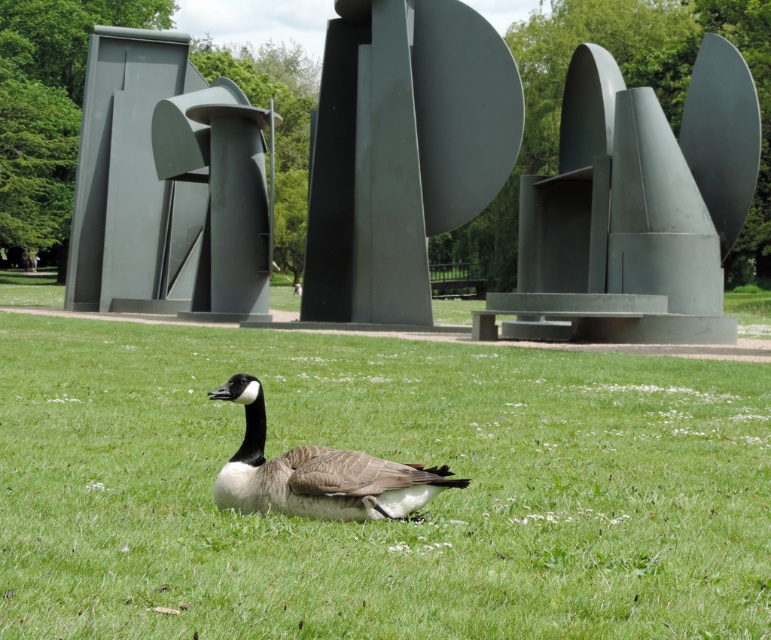
Question: Where is matte gray sculpture at center located in relation to metallic gray abstract sculpture at center in the image?

Choices:
 (A) left
 (B) right

Answer: (B)

Question: Where is metallic gray abstract sculpture at center located in relation to brown feathered duck at center in the image?

Choices:
 (A) right
 (B) left

Answer: (B)

Question: Among these points, which one is nearest to the camera?

Choices:
 (A) (179, 262)
 (B) (298, 496)
 (C) (601, 147)
 (D) (648, 538)

Answer: (B)

Question: Is green grass at center to the right of matte gray abstract sculpture at center from the viewer's perspective?

Choices:
 (A) no
 (B) yes

Answer: (B)

Question: Which object is positioned farthest from the green grass at center?

Choices:
 (A) matte gray abstract sculpture at center
 (B) metallic gray abstract sculpture at center

Answer: (A)

Question: Which point is closer to the camera?

Choices:
 (A) (207, 241)
 (B) (19, 572)
 (C) (364, 204)
 (D) (618, 176)

Answer: (B)